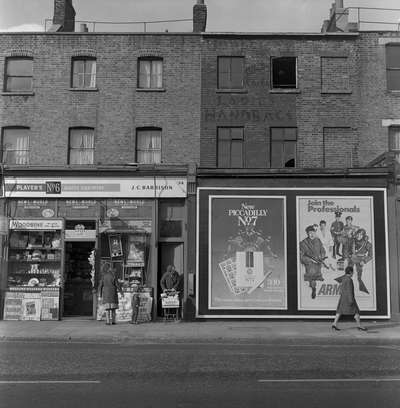
Identify the location of window that has a hole in it on the lower right hand side of it. This screenshot has height=408, width=400. (292, 165).